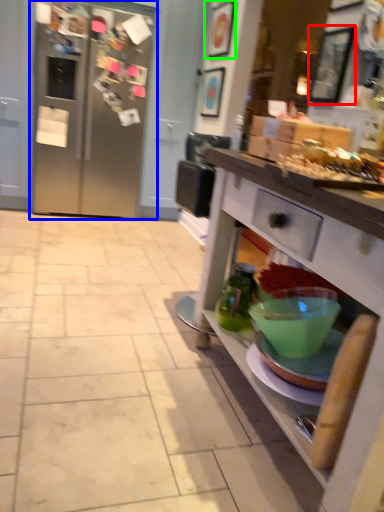
Question: Considering the real-world distances, which object is farthest from picture frame (highlighted by a red box)? refrigerator (highlighted by a blue box) or picture frame (highlighted by a green box)?

Choices:
 (A) refrigerator
 (B) picture frame

Answer: (A)